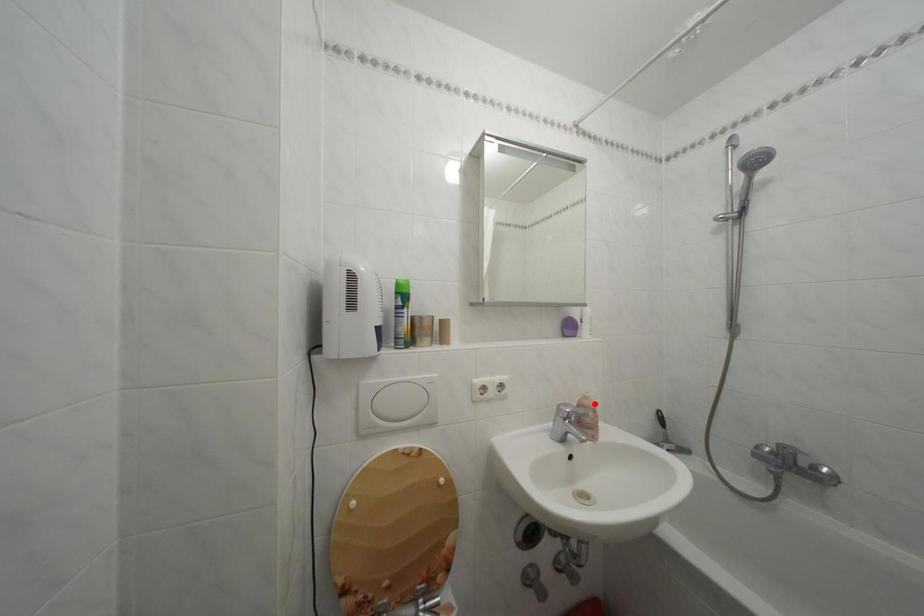
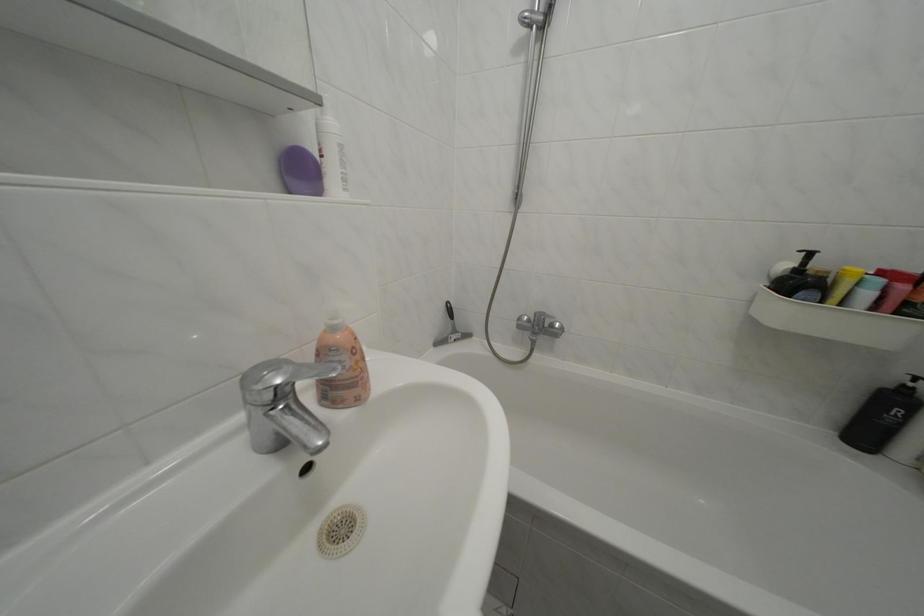
Question: A red point is marked in image1. In image2, is the corresponding 3D point closer to the camera or farther? Reply with the corresponding letter.

Choices:
 (A) The corresponding 3D point is closer.
 (B) The corresponding 3D point is farther.

Answer: (A)